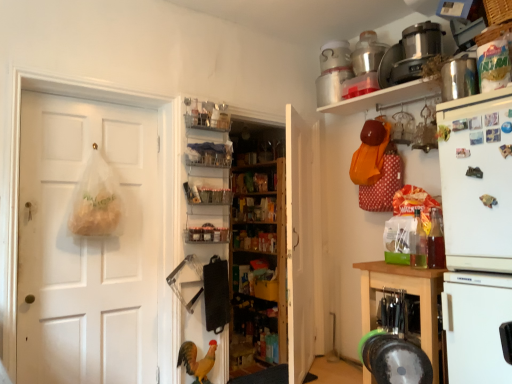
Measure the distance between clear plastic shelf at center, which is counted as the second shelf, starting from the right, and camera.

clear plastic shelf at center, which is counted as the second shelf, starting from the right, and camera are 2.76 meters apart.

The image size is (512, 384). Describe the element at coordinates (477, 233) in the screenshot. I see `white matte refrigerator at right` at that location.

You are a GUI agent. You are given a task and a screenshot of the screen. Output one action in this format:
    pyautogui.click(x=<x>, y=<y>)
    Task: Click on the clear plastic container at center, the 2th shelf ordered from the bottom
    
    Given the screenshot: What is the action you would take?
    pyautogui.click(x=206, y=194)

The height and width of the screenshot is (384, 512). Describe the element at coordinates (298, 246) in the screenshot. I see `white matte door at center, positioned as the 1th door in right-to-left order` at that location.

I want to click on clear plastic shelf at center, the 1th shelf ordered from the bottom, so click(207, 228).

Starting from the wooden cabinet at lower right, which shelf is the 3rd one to the left? Please provide its 2D coordinates.

[(206, 194)]

Considering the sizes of wooden cabinet at lower right and clear plastic container at center, arranged as the third shelf when viewed from the top, in the image, is wooden cabinet at lower right wider or thinner than clear plastic container at center, arranged as the third shelf when viewed from the top,?

wooden cabinet at lower right is wider than clear plastic container at center, arranged as the third shelf when viewed from the top.

From the image's perspective, which one is positioned lower, white matte refrigerator at right or metallic rectangular magnet at upper right, the first magnet in the top-to-bottom sequence?

From the image's view, white matte refrigerator at right is below.

Considering the sizes of objects white matte refrigerator at right and metallic rectangular magnet at upper right, the 2th magnet ordered from the bottom, in the image provided, who is smaller, white matte refrigerator at right or metallic rectangular magnet at upper right, the 2th magnet ordered from the bottom,?

Smaller between the two is metallic rectangular magnet at upper right, the 2th magnet ordered from the bottom.

Which of these two, white matte refrigerator at right or metallic rectangular magnet at upper right, the first magnet in the top-to-bottom sequence, is wider?

white matte refrigerator at right.

Is white matte refrigerator at right not within metallic rectangular magnet at upper right, the 2th magnet ordered from the bottom?

That's correct, white matte refrigerator at right is outside of metallic rectangular magnet at upper right, the 2th magnet ordered from the bottom.

Find the location of `the 1st appliance in front of the yellow matte chicken at lower center`. the 1st appliance in front of the yellow matte chicken at lower center is located at coordinates (416, 51).

From a real-world perspective, does yellow matte chicken at lower center stand above metallic silver food processor at upper right, acting as the third appliance starting from the front?

No, from a real-world perspective, yellow matte chicken at lower center is not above metallic silver food processor at upper right, acting as the third appliance starting from the front.

Looking at this image, considering the relative sizes of yellow matte chicken at lower center and metallic silver food processor at upper right, acting as the 1th appliance starting from the top, in the image provided, is yellow matte chicken at lower center shorter than metallic silver food processor at upper right, acting as the 1th appliance starting from the top,?

No, yellow matte chicken at lower center is not shorter than metallic silver food processor at upper right, acting as the 1th appliance starting from the top.

Does yellow matte chicken at lower center touch metallic silver food processor at upper right, acting as the third appliance starting from the front?

They are not placed beside each other.

From the picture: Is translucent plastic coffee cup at right not near metallic silver food processor at upper right, acting as the 1th appliance starting from the top?

translucent plastic coffee cup at right is near metallic silver food processor at upper right, acting as the 1th appliance starting from the top, not far away.

Can you confirm if translucent plastic coffee cup at right is taller than metallic silver food processor at upper right, the first appliance when ordered from back to front?

Indeed, translucent plastic coffee cup at right has a greater height compared to metallic silver food processor at upper right, the first appliance when ordered from back to front.

Is translucent plastic coffee cup at right wider than metallic silver food processor at upper right, acting as the third appliance starting from the front?

In fact, translucent plastic coffee cup at right might be narrower than metallic silver food processor at upper right, acting as the third appliance starting from the front.

In the scene shown: From a real-world perspective, is translucent plastic coffee cup at right above or below metallic silver food processor at upper right, acting as the third appliance starting from the front?

Clearly, from a real-world perspective, translucent plastic coffee cup at right is below metallic silver food processor at upper right, acting as the third appliance starting from the front.

Which of these two, clear plastic shelf at center, which is counted as the second shelf, starting from the right, or metallic stainless steel container at upper right, which is counted as the 2th appliance, starting from the front, stands taller?

metallic stainless steel container at upper right, which is counted as the 2th appliance, starting from the front.

From the image's perspective, is clear plastic shelf at center, the 1th shelf ordered from the bottom, below metallic stainless steel container at upper right, which is counted as the 2th appliance, starting from the front?

Yes.

Which is more to the right, white matte door at center, positioned as the 1th door in right-to-left order, or white plastic refrigerator at lower right, marked as the third appliance in a back-to-front arrangement?

Positioned to the right is white plastic refrigerator at lower right, marked as the third appliance in a back-to-front arrangement.

Measure the distance from white matte door at center, arranged as the second door when viewed from the left, to white plastic refrigerator at lower right, which is the 1th appliance in front-to-back order.

white matte door at center, arranged as the second door when viewed from the left, is 3.70 feet away from white plastic refrigerator at lower right, which is the 1th appliance in front-to-back order.

Is white matte door at center, positioned as the 1th door in right-to-left order, facing away from white plastic refrigerator at lower right, which is the 1th appliance in front-to-back order?

No, white plastic refrigerator at lower right, which is the 1th appliance in front-to-back order, is not at the back of white matte door at center, positioned as the 1th door in right-to-left order.

Identify the location of door that is the 2nd object above the white plastic refrigerator at lower right, which is counted as the third appliance, starting from the top (from a real-world perspective). The image size is (512, 384). (298, 246).

Can you tell me how much clear plastic shelves at center, placed as the second shelf when sorted from top to bottom, and white matte refrigerator at right differ in facing direction?

There is a 91.3-degree angle between the facing directions of clear plastic shelves at center, placed as the second shelf when sorted from top to bottom, and white matte refrigerator at right.

From a real-world perspective, which object rests below the other?

white matte refrigerator at right is physically lower.

Could you tell me if clear plastic shelves at center, acting as the 4th shelf starting from the right, is facing white matte refrigerator at right?

Yes, clear plastic shelves at center, acting as the 4th shelf starting from the right, is facing white matte refrigerator at right.

Considering the sizes of objects clear plastic shelves at center, which is the 1th shelf in left-to-right order, and white matte refrigerator at right in the image provided, who is shorter, clear plastic shelves at center, which is the 1th shelf in left-to-right order, or white matte refrigerator at right?

Standing shorter between the two is clear plastic shelves at center, which is the 1th shelf in left-to-right order.

The image size is (512, 384). Find the location of `cabinetry located underneath the clear plastic container at center, the 2th shelf ordered from the bottom (from a real-world perspective)`. cabinetry located underneath the clear plastic container at center, the 2th shelf ordered from the bottom (from a real-world perspective) is located at coordinates (407, 293).

Starting from the white matte refrigerator at right, which magnet is the 2nd one to the left? Please provide its 2D coordinates.

[(474, 172)]

Considering their positions, is wooden cabinet at lower right positioned further to metallic silver magnet at upper right, the 2th magnet positioned from the top, than white matte door at left, which is counted as the second door, starting from the right?

white matte door at left, which is counted as the second door, starting from the right, is further to metallic silver magnet at upper right, the 2th magnet positioned from the top.

From the picture: Looking at the image, which one is located further to metallic silver container at upper right, placed as the fourth shelf when sorted from bottom to top, wooden shelves at center, the 2th bookshelf from the front, or wooden cabinet at lower right?

wooden shelves at center, the 2th bookshelf from the front, is positioned further to the anchor metallic silver container at upper right, placed as the fourth shelf when sorted from bottom to top.

Looking at this image, from the image, which object appears to be nearer to metallic stainless steel container at upper right, marked as the second appliance in a top-to-bottom arrangement, wooden shelves at center, which is counted as the 2th bookshelf, starting from the back, or wooden shelves at center, the 2th bookshelf from the front?

wooden shelves at center, the 2th bookshelf from the front.

From the image, which object appears to be farther from white plastic refrigerator at lower right, marked as the third appliance in a back-to-front arrangement, clear plastic shelf at center, the 4th shelf positioned from the top, or metallic rectangular magnet at upper right, the first magnet in the top-to-bottom sequence?

clear plastic shelf at center, the 4th shelf positioned from the top, is positioned further to the anchor white plastic refrigerator at lower right, marked as the third appliance in a back-to-front arrangement.

Considering their positions, is metallic rectangular magnet at upper right, the 2th magnet ordered from the bottom, positioned closer to white matte refrigerator at right than clear plastic container at center, arranged as the third shelf when viewed from the right?

metallic rectangular magnet at upper right, the 2th magnet ordered from the bottom.

In the scene shown: Which object lies nearer to the anchor point metallic silver container at upper right, placed as the first shelf when sorted from right to left, yellow matte chicken at lower center or translucent plastic coffee cup at right?

The object closer to metallic silver container at upper right, placed as the first shelf when sorted from right to left, is translucent plastic coffee cup at right.

When comparing their distances from metallic silver food processor at upper right, positioned as the 3th appliance in bottom-to-top order, does metallic rectangular magnet at upper right, the 2th magnet ordered from the bottom, or wooden cabinet at lower right seem further?

wooden cabinet at lower right lies further to metallic silver food processor at upper right, positioned as the 3th appliance in bottom-to-top order, than the other object.

From the picture: Considering their positions, is translucent plastic coffee cup at right positioned further to wooden shelves at center, acting as the 1th bookshelf starting from the front, than white matte refrigerator at right?

Among the two, white matte refrigerator at right is located further to wooden shelves at center, acting as the 1th bookshelf starting from the front.

In order to click on coffee cup between white matte refrigerator at right and white plastic refrigerator at lower right, marked as the third appliance in a back-to-front arrangement, vertically in this screenshot , I will do pos(436,241).

You are a GUI agent. You are given a task and a screenshot of the screen. Output one action in this format:
    pyautogui.click(x=<x>, y=<y>)
    Task: Click on the shelf between clear plastic shelf at center, which is counted as the second shelf, starting from the right, and wooden cabinet at lower right
    This screenshot has width=512, height=384.
    Given the screenshot: What is the action you would take?
    pyautogui.click(x=384, y=97)

Where is `magnet between metallic silver container at upper right, placed as the first shelf when sorted from right to left, and metallic silver magnet at upper right, the 2th magnet positioned from the top, vertically`? magnet between metallic silver container at upper right, placed as the first shelf when sorted from right to left, and metallic silver magnet at upper right, the 2th magnet positioned from the top, vertically is located at coordinates (474, 172).

The height and width of the screenshot is (384, 512). What are the coordinates of `door located between clear plastic shelves at center, which is the 1th shelf in left-to-right order, and white matte refrigerator at right in the left-right direction` in the screenshot? It's located at (298, 246).